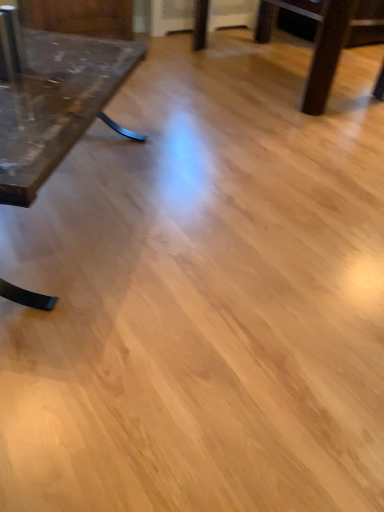
Question: Should I look upward or downward to see matte glass table at left?

Choices:
 (A) down
 (B) up

Answer: (B)